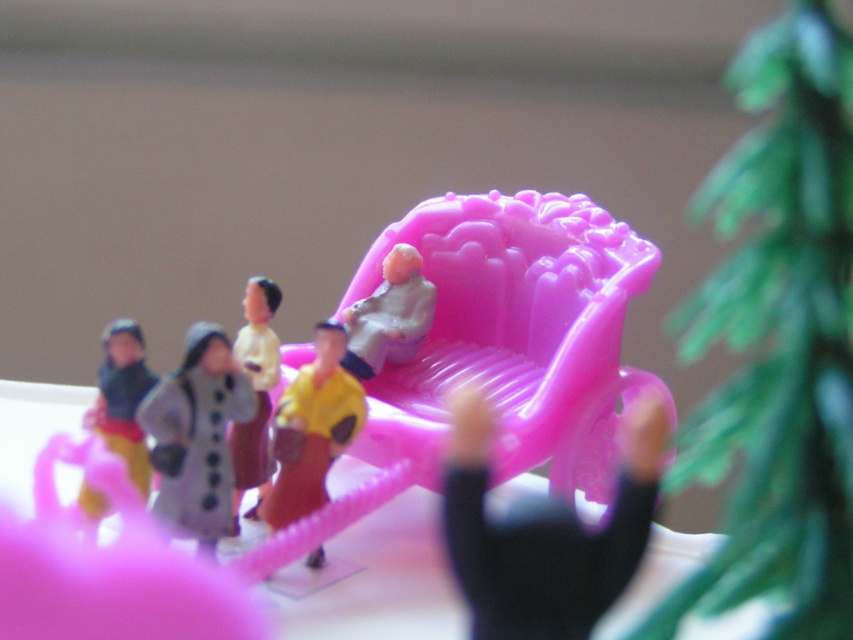
Question: Observing the image, what is the correct spatial positioning of black matte figure at center in reference to matte black figurine at left?

Choices:
 (A) right
 (B) left

Answer: (A)

Question: Considering the relative positions of gray matte coat at center and matte white figure at center in the image provided, where is gray matte coat at center located with respect to matte white figure at center?

Choices:
 (A) above
 (B) below

Answer: (B)

Question: In this image, where is pink plastic armchair at center located relative to matte black figurine at left?

Choices:
 (A) above
 (B) below

Answer: (A)

Question: Which of the following is the farthest from the observer?

Choices:
 (A) black matte figure at center
 (B) matte black figurine at left
 (C) matte white figure at center
 (D) pink plastic armchair at center

Answer: (C)

Question: Which object is closer to the camera taking this photo?

Choices:
 (A) black matte figure at center
 (B) gray matte coat at center
 (C) matte white figure at center

Answer: (A)

Question: Which of the following is the closest to the observer?

Choices:
 (A) (289, 435)
 (B) (251, 342)
 (C) (100, 428)

Answer: (A)